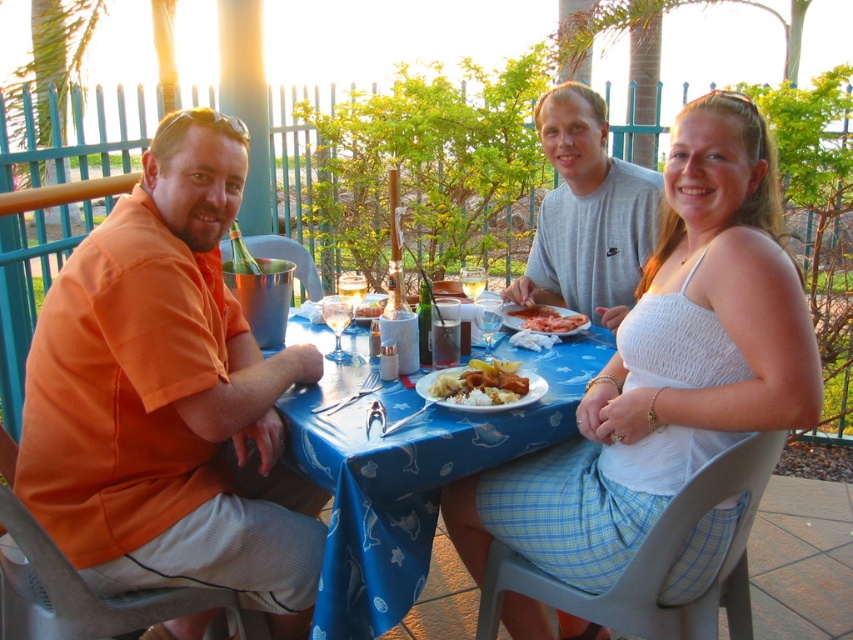
Is orange cotton shirt at left shorter than shiny pink meat at center?

In fact, orange cotton shirt at left may be taller than shiny pink meat at center.

This screenshot has width=853, height=640. What are the coordinates of `orange cotton shirt at left` in the screenshot? It's located at pos(167,397).

Find the location of a particular element. This screenshot has height=640, width=853. orange cotton shirt at left is located at coordinates (167, 397).

In the scene shown: Can you confirm if orange cotton shirt at left is positioned to the left of gray cotton shirt at center?

Indeed, orange cotton shirt at left is positioned on the left side of gray cotton shirt at center.

Which of these two, orange cotton shirt at left or gray cotton shirt at center, stands taller?

Standing taller between the two is orange cotton shirt at left.

Does point (215, 515) come farther from viewer compared to point (567, 100)?

No, (215, 515) is in front of (567, 100).

Where is `orange cotton shirt at left`? orange cotton shirt at left is located at coordinates (167, 397).

Does white textured tank top at center appear over shiny pink meat at center?

No.

Describe the element at coordinates (666, 365) in the screenshot. I see `white textured tank top at center` at that location.

At what (x,y) coordinates should I click in order to perform the action: click on white textured tank top at center. Please return your answer as a coordinate pair (x, y). Looking at the image, I should click on (666, 365).